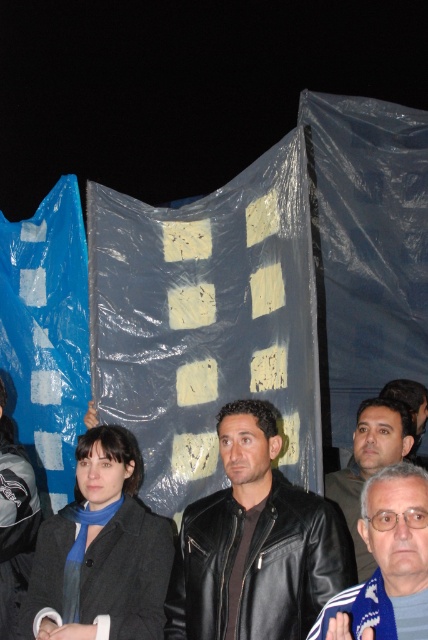
Between black leather jacket at lower left and dark brown leather jacket at lower right, which one has less height?

dark brown leather jacket at lower right

How much distance is there between black leather jacket at lower left and dark brown leather jacket at lower right?

The distance of black leather jacket at lower left from dark brown leather jacket at lower right is 6.20 feet.

Measure the distance between point (0, 449) and camera.

The distance of point (0, 449) from camera is 16.89 feet.

This screenshot has width=428, height=640. I want to click on black leather jacket at lower left, so click(x=14, y=522).

Between black leather jacket at center and black leather jacket at lower left, which one is positioned higher?

black leather jacket at center is above.

At what (x,y) coordinates should I click in order to perform the action: click on black leather jacket at center. Please return your answer as a coordinate pair (x, y). The width and height of the screenshot is (428, 640). Looking at the image, I should click on (255, 545).

Image resolution: width=428 pixels, height=640 pixels. Identify the location of black leather jacket at center. (255, 545).

Who is higher up, black leather jacket at center or dark brown leather jacket at lower right?

dark brown leather jacket at lower right

Who is more forward, (273, 422) or (359, 444)?

Point (273, 422)

Locate an element on the screen. Image resolution: width=428 pixels, height=640 pixels. black leather jacket at center is located at coordinates (255, 545).